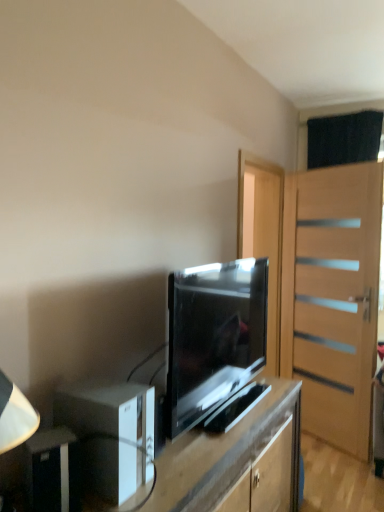
Identify the location of vacant point to the right of black plastic speaker at lower left, arranged as the second appliance when viewed from the back. (117, 499).